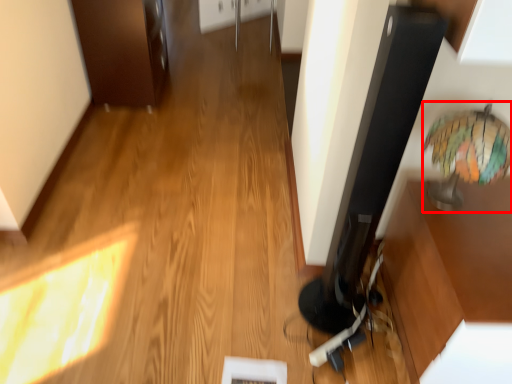
Question: Considering the relative positions of table lamp (annotated by the red box) and cabinetry in the image provided, where is table lamp (annotated by the red box) located with respect to the staircase?

Choices:
 (A) right
 (B) left

Answer: (A)